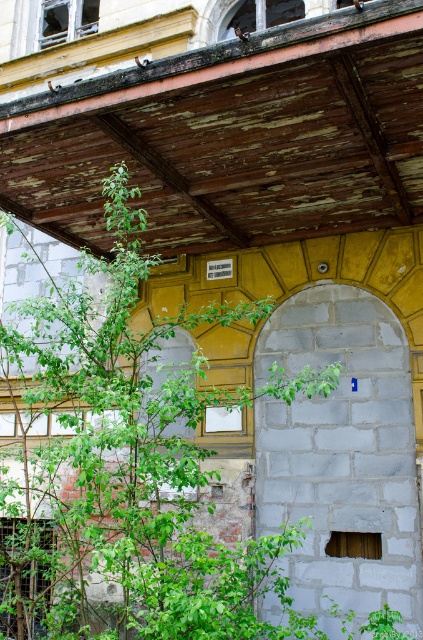
You are standing in front of the building and want to take a photo of both the green leafy tree at center and the gray stone pillar at center. Which object should you focus on first to ensure both are in focus?

You should focus on the gray stone pillar at center first because it is farther away from the viewer than the green leafy tree at center, ensuring both will be in focus when focusing on the farther object.

You are a painter standing in front of the building and want to paint both the green leafy tree at center and the gray stone pillar at center. Which object should you focus on first if you want to paint the larger one first?

The green leafy tree at center is larger in size than the gray stone pillar at center, so you should focus on painting the green leafy tree at center first.

You are a delivery person with a box that is 2 meters long. You need to navigate through the space between the green leafy tree at center and the gray stone pillar at center. Can your box fit through the gap without bending it?

The distance between the green leafy tree at center and gray stone pillar at center is 1.88 meters. Since the box is 2 meters long, it is longer than the available space, so the box cannot fit through the gap without bending it.